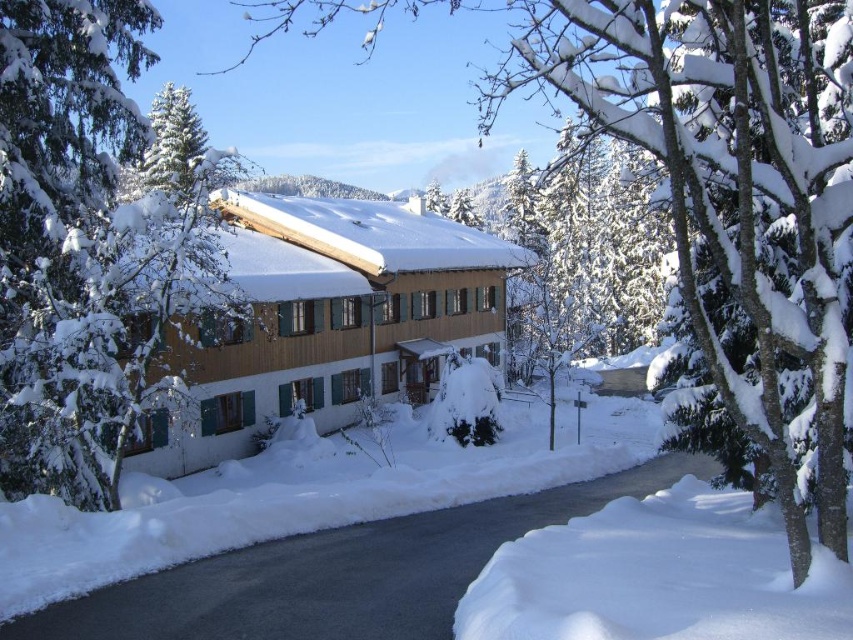
You are standing at the center of the image and want to walk towards the green matte tree at left. Which direction should you face to head directly towards it?

The green matte tree at left is located at the left side of the image, so you should face towards the left direction to head directly towards it.

You are standing in front of the house and want to walk towards the green matte tree at left. Will you pass by the white fluffy snow at lower right on your way?

The green matte tree at left is closer to you than the white fluffy snow at lower right, so you will not pass by the white fluffy snow at lower right on your way to the tree.